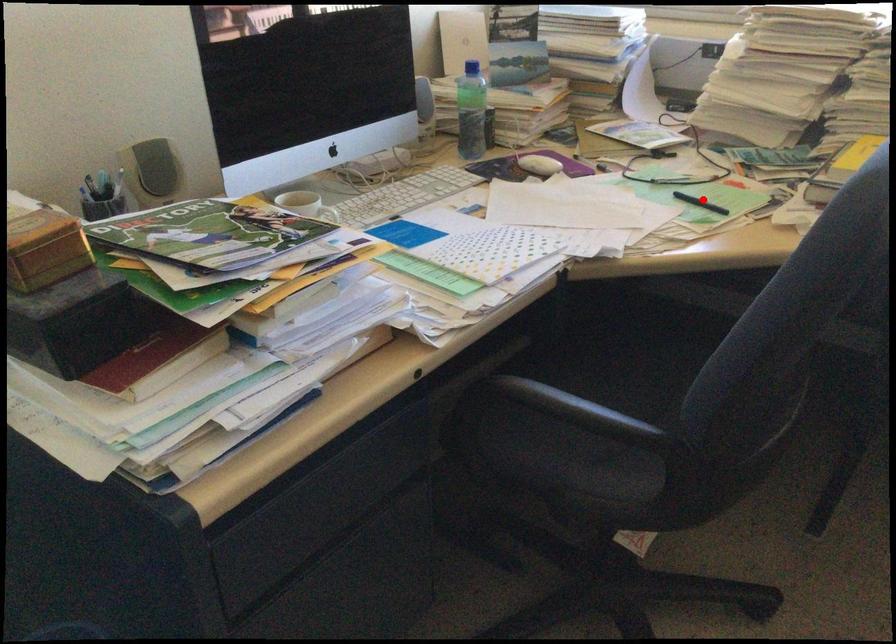
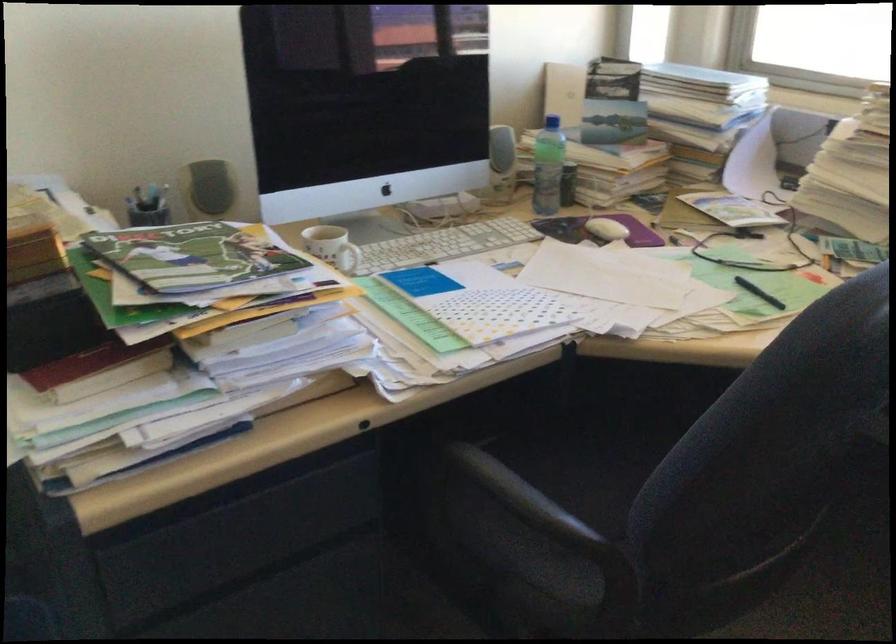
Locate, in the second image, the point that corresponds to the highlighted location in the first image.

(759, 292)